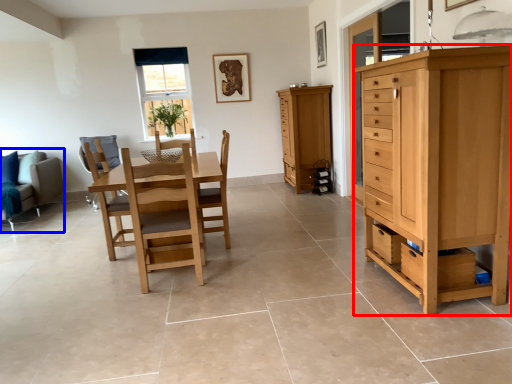
Question: Which of the following is the farthest to the observer, chest of drawers (highlighted by a red box) or studio couch (highlighted by a blue box)?

Choices:
 (A) chest of drawers
 (B) studio couch

Answer: (B)